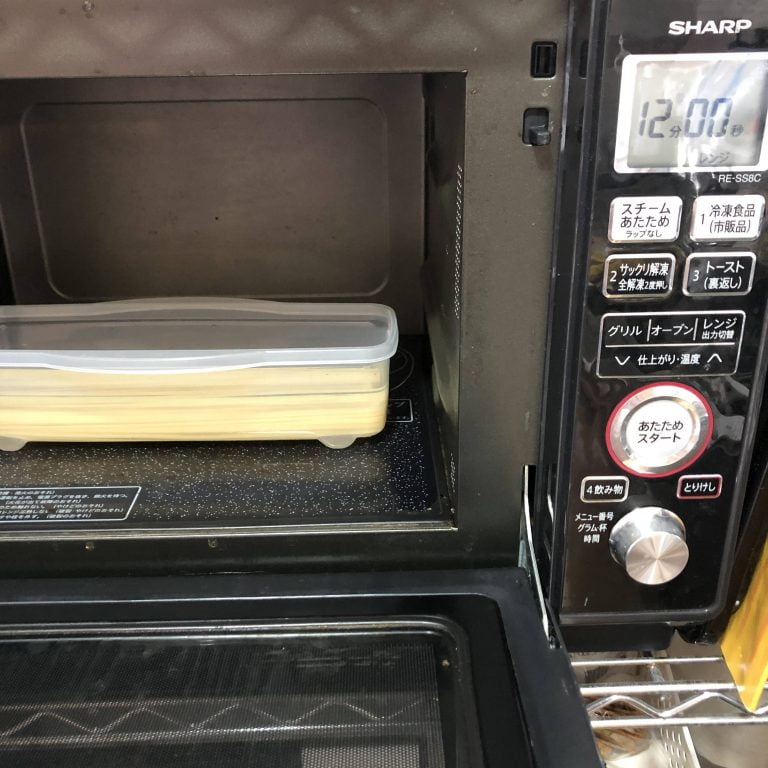
Where is `white rectangular plastic lid`? The width and height of the screenshot is (768, 768). white rectangular plastic lid is located at coordinates (216, 362).